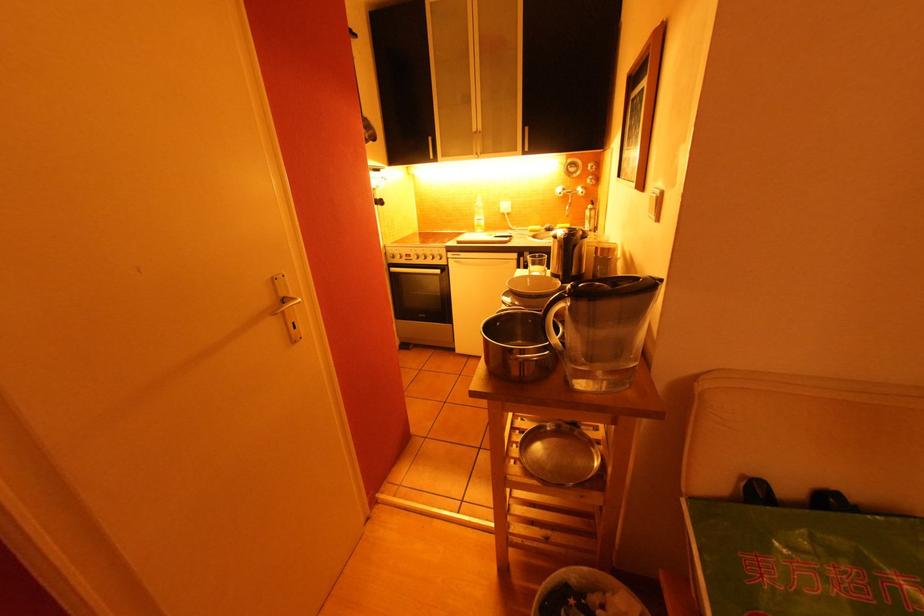
Where would you turn the faucet handle? Please return your answer as a coordinate pair (x, y).

(569, 193)